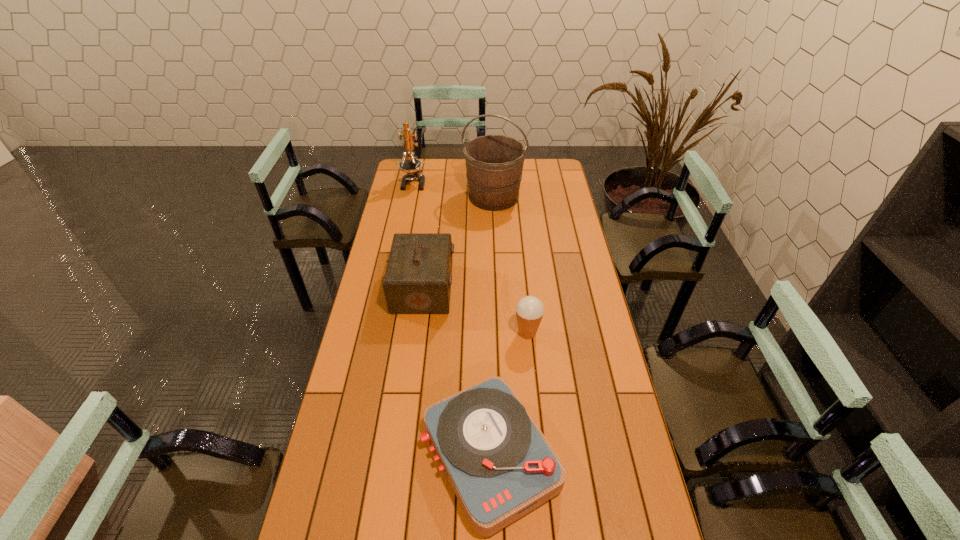
Image resolution: width=960 pixels, height=540 pixels. Find the location of `vacant area that lies between the second tallest object and the fourth farthest object`. vacant area that lies between the second tallest object and the fourth farthest object is located at coordinates (470, 258).

Select which object appears as the third closest to the fourth shortest object. Please provide its 2D coordinates. Your answer should be formatted as a tuple, i.e. [(x, y)], where the tuple contains the x and y coordinates of a point satisfying the conditions above.

[(529, 310)]

You are a GUI agent. You are given a task and a screenshot of the screen. Output one action in this format:
    pyautogui.click(x=<x>, y=<y>)
    Task: Click on the object that is the fourth closest one to the second nearest object
    
    Given the screenshot: What is the action you would take?
    pyautogui.click(x=412, y=166)

You are a GUI agent. You are given a task and a screenshot of the screen. Output one action in this format:
    pyautogui.click(x=<x>, y=<y>)
    Task: Click on the vacant space that satisfies the following two spatial constraints: 1. at the eyepiece of the nearest object; 2. on the right side of the second tallest object
    The height and width of the screenshot is (540, 960).
    Given the screenshot: What is the action you would take?
    pyautogui.click(x=359, y=456)

Locate an element on the screen. vacant area that satisfies the following two spatial constraints: 1. at the eyepiece of the icecream; 2. on the left side of the fourth shortest object is located at coordinates (383, 333).

Find the location of a particular element. This screenshot has width=960, height=540. vacant region that satisfies the following two spatial constraints: 1. at the eyepiece of the fourth farthest object; 2. on the left side of the microscope is located at coordinates (383, 333).

I want to click on free point that satisfies the following two spatial constraints: 1. at the eyepiece of the shortest object; 2. on the right side of the microscope, so click(x=359, y=456).

In order to click on vacant area in the image that satisfies the following two spatial constraints: 1. at the eyepiece of the first-aid kit; 2. on the left side of the microscope in this screenshot , I will do `click(393, 288)`.

This screenshot has height=540, width=960. I want to click on vacant space that satisfies the following two spatial constraints: 1. on the back side of the tallest object; 2. on the right side of the third shortest object, so click(x=435, y=197).

This screenshot has width=960, height=540. What are the coordinates of `vacant space that satisfies the following two spatial constraints: 1. at the eyepiece of the second nearest object; 2. on the right side of the microscope` in the screenshot? It's located at (383, 333).